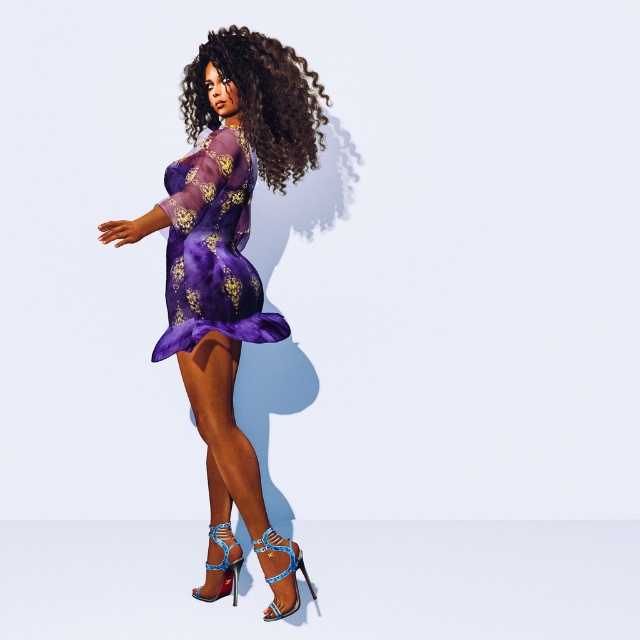
Does curly hair at upper center have a greater width compared to satin shiny high-heeled sandals at lower center?

Correct, the width of curly hair at upper center exceeds that of satin shiny high-heeled sandals at lower center.

Consider the image. Is curly hair at upper center above satin shiny high-heeled sandals at lower center?

Yes, curly hair at upper center is above satin shiny high-heeled sandals at lower center.

Which is behind, point (188, 109) or point (198, 422)?

Positioned behind is point (188, 109).

Locate an element on the screen. This screenshot has width=640, height=640. curly hair at upper center is located at coordinates (259, 100).

Which is below, purple sheer dress at center or satin shiny high-heeled sandals at lower center?

Positioned lower is satin shiny high-heeled sandals at lower center.

Which is in front, point (230, 204) or point (205, 589)?

Point (230, 204) is in front.

Measure the distance between point (x=234, y=301) and camera.

The distance of point (x=234, y=301) from camera is 11.33 feet.

This screenshot has width=640, height=640. I want to click on purple sheer dress at center, so click(212, 248).

Which is below, purple satin dress at center or blue metallic sandal at lower center?

blue metallic sandal at lower center is lower down.

Does purple satin dress at center lie in front of blue metallic sandal at lower center?

Yes, purple satin dress at center is in front of blue metallic sandal at lower center.

At what (x,y) coordinates should I click in order to perform the action: click on purple satin dress at center. Please return your answer as a coordinate pair (x, y). Looking at the image, I should click on (227, 236).